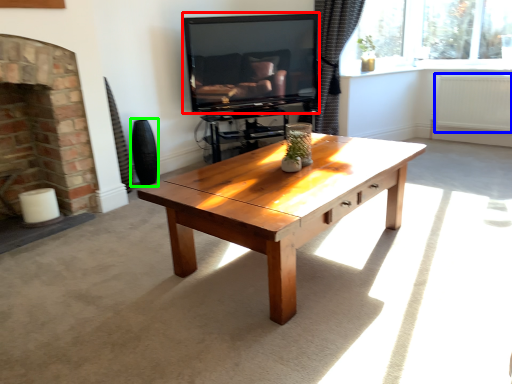
Question: Which is farther away from television (highlighted by a red box)? radiator (highlighted by a blue box) or vase (highlighted by a green box)?

Choices:
 (A) radiator
 (B) vase

Answer: (A)